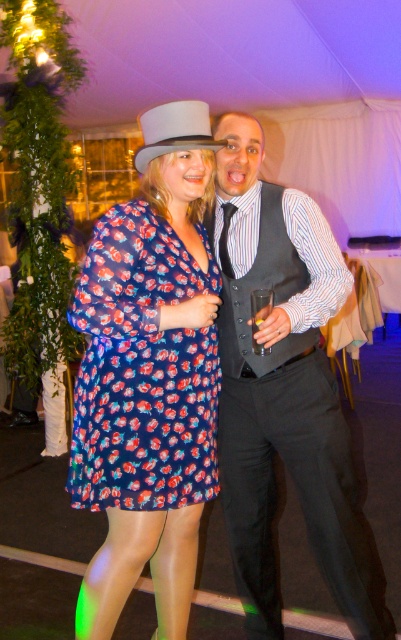
Question: Which point is closer to the camera taking this photo?

Choices:
 (A) (226, 273)
 (B) (149, 134)
 (C) (273, 572)
 (D) (83, 296)

Answer: (D)

Question: Is floral print fabric dress at center thinner than gray felt fedora at upper center?

Choices:
 (A) yes
 (B) no

Answer: (B)

Question: Which object appears closest to the camera in this image?

Choices:
 (A) matte black vest at center
 (B) floral print fabric dress at center
 (C) gray felt fedora at upper center

Answer: (B)

Question: In this image, where is matte black vest at center located relative to black satin tie at center?

Choices:
 (A) right
 (B) left

Answer: (A)

Question: Is floral print fabric dress at center to the right of black satin tie at center from the viewer's perspective?

Choices:
 (A) no
 (B) yes

Answer: (A)

Question: Which point is closer to the camera?

Choices:
 (A) tap(107, 445)
 (B) tap(226, 212)

Answer: (A)